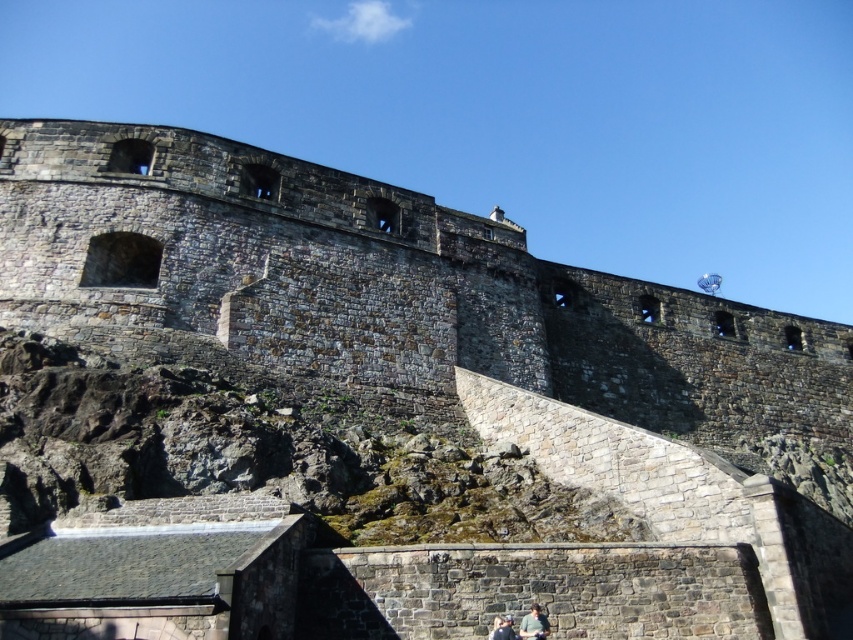
Question: Considering the real-world distances, which object is farthest from the green fabric couple at lower center?

Choices:
 (A) matte stone couple at lower center
 (B) matte black couple at lower center

Answer: (B)

Question: Which of the following is the farthest from the observer?

Choices:
 (A) green fabric couple at lower center
 (B) matte stone couple at lower center
 (C) matte black couple at lower center

Answer: (A)

Question: Is matte stone couple at lower center positioned before matte black couple at lower center?

Choices:
 (A) no
 (B) yes

Answer: (A)

Question: Which point is farther from the camera taking this photo?

Choices:
 (A) click(x=535, y=611)
 (B) click(x=508, y=618)

Answer: (B)

Question: Where is matte stone couple at lower center located in relation to green fabric couple at lower center in the image?

Choices:
 (A) above
 (B) below

Answer: (B)

Question: Observing the image, what is the correct spatial positioning of matte stone couple at lower center in reference to green fabric couple at lower center?

Choices:
 (A) right
 (B) left

Answer: (B)